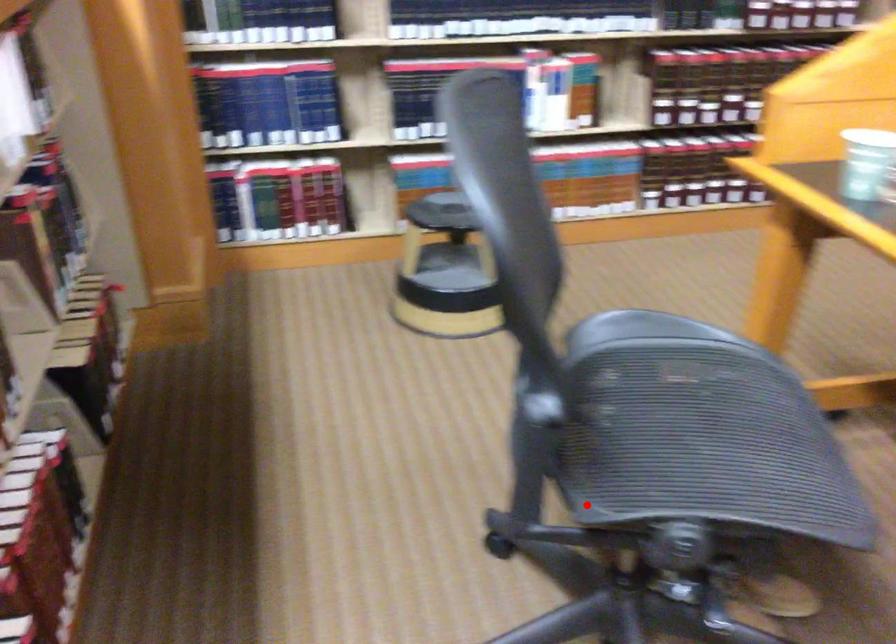
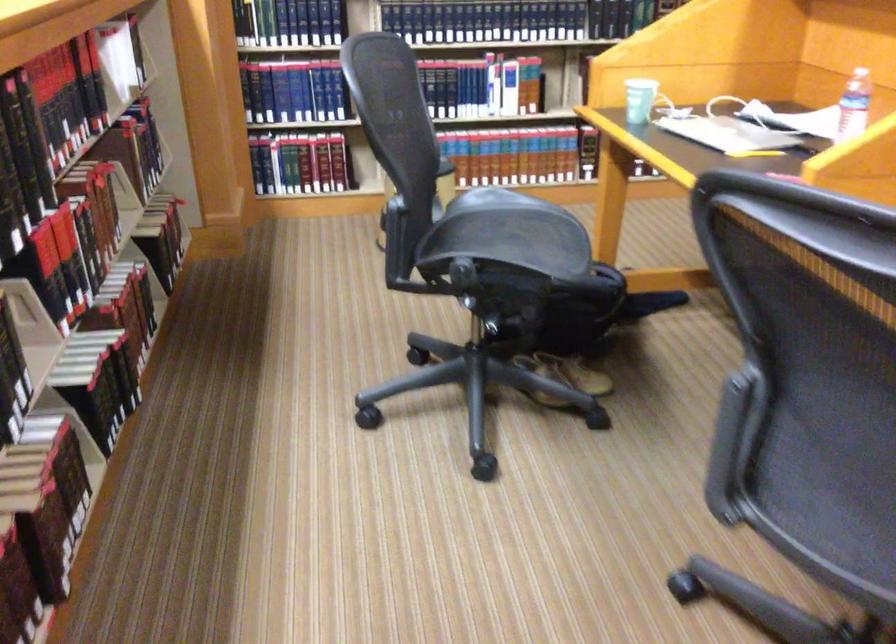
Question: A red point is marked in image1. In image2, is the corresponding 3D point closer to the camera or farther? Reply with the corresponding letter.

Choices:
 (A) The corresponding 3D point is closer.
 (B) The corresponding 3D point is farther.

Answer: (B)